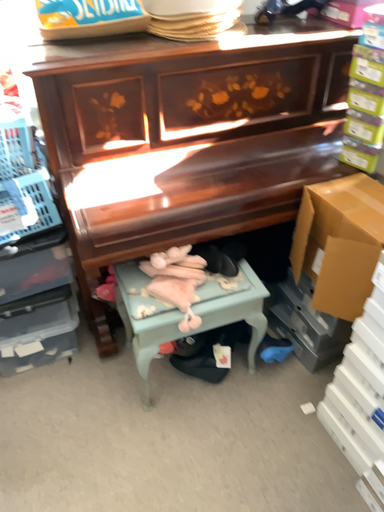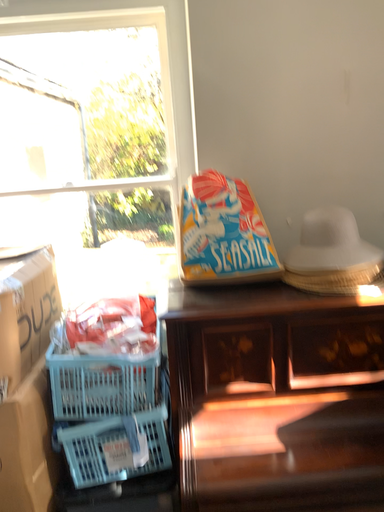
Question: Which way did the camera rotate in the video?

Choices:
 (A) rotated upward
 (B) rotated downward

Answer: (A)